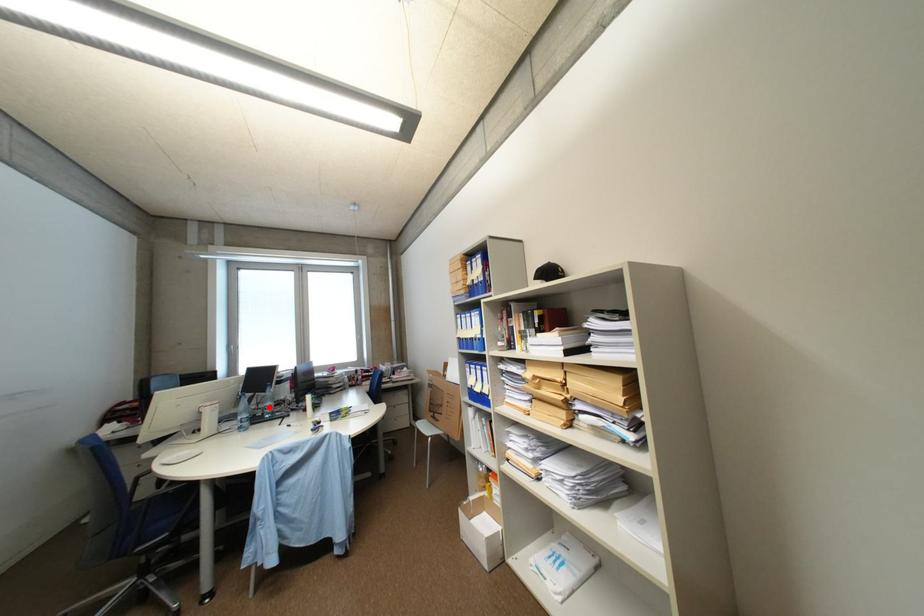
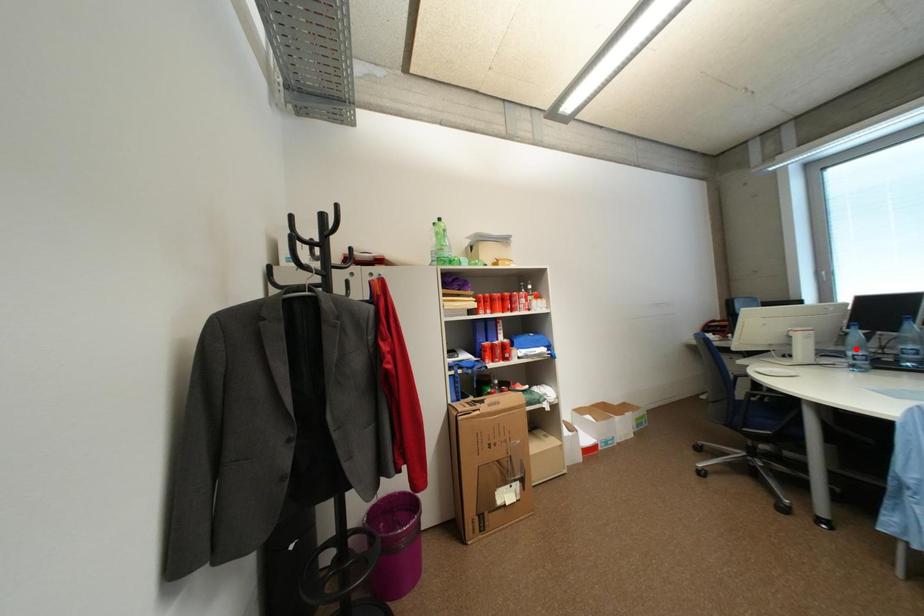
I am providing you with two images of the same scene from different viewpoints. A red point is marked on the first image and another point is marked on the second image. Are the points marked in image1 and image2 representing the same 3D position?

No